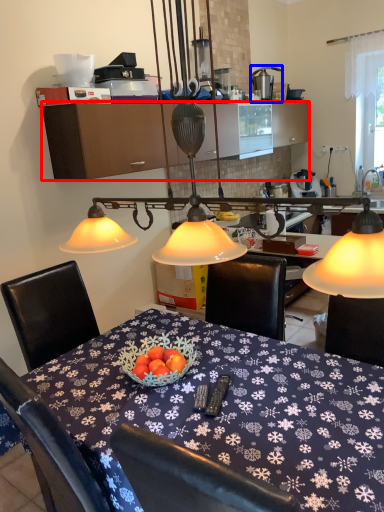
Question: Which object is closer to the camera taking this photo, cabinetry (highlighted by a red box) or tableware (highlighted by a blue box)?

Choices:
 (A) cabinetry
 (B) tableware

Answer: (A)